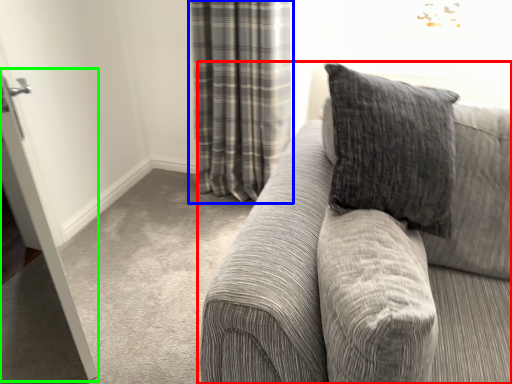
Question: Based on their relative distances, which object is farther from studio couch (highlighted by a red box)? Choose from curtain (highlighted by a blue box) and screen door (highlighted by a green box).

Choices:
 (A) curtain
 (B) screen door

Answer: (A)